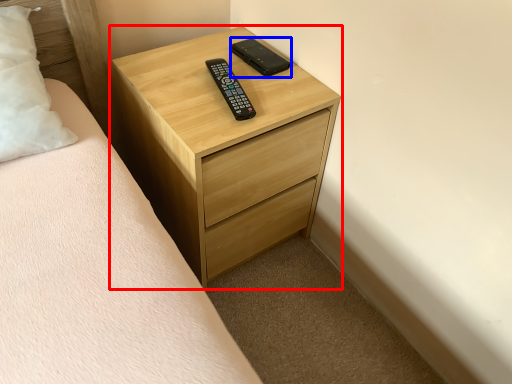
Question: Which of the following is the farthest to the observer, chest of drawers (highlighted by a red box) or control (highlighted by a blue box)?

Choices:
 (A) chest of drawers
 (B) control

Answer: (B)